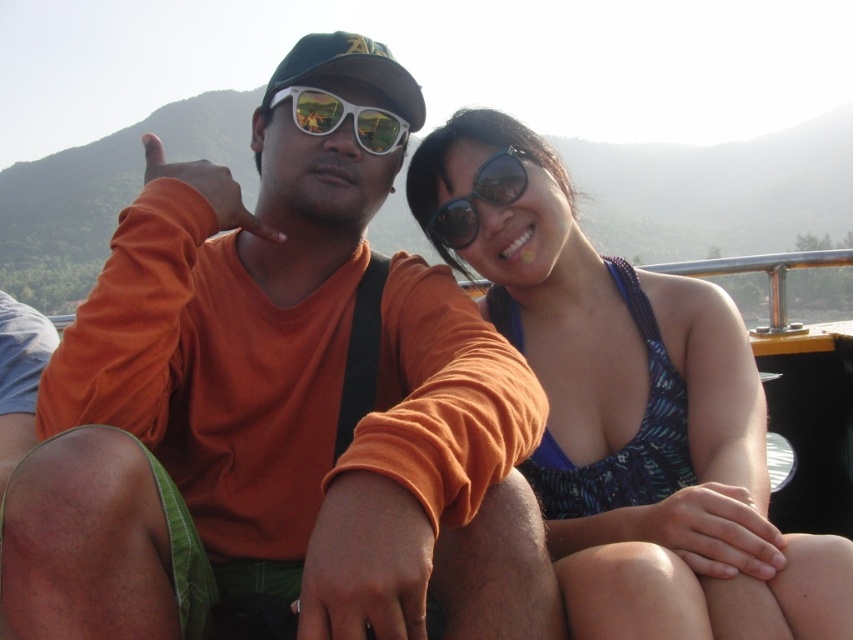
You are a photographer trying to capture a closeup of the sunglasses at center. Given that your camera has a focal length of 50mm and you are standing 2 meters away from the sunglasses, can you estimate the approximate size of the sunglasses in millimeters using the coordinates provided?

The sunglasses at center are located at coordinates point [479,198]. However, without knowing the actual dimensions of the image sensor or the distance scaling, it is impossible to calculate the physical size of the sunglasses based solely on the provided coordinates.